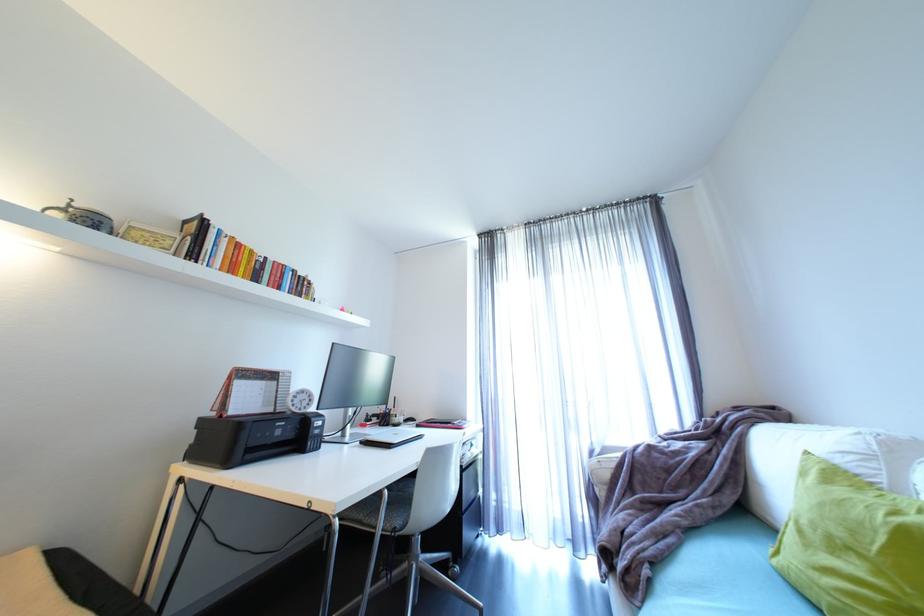
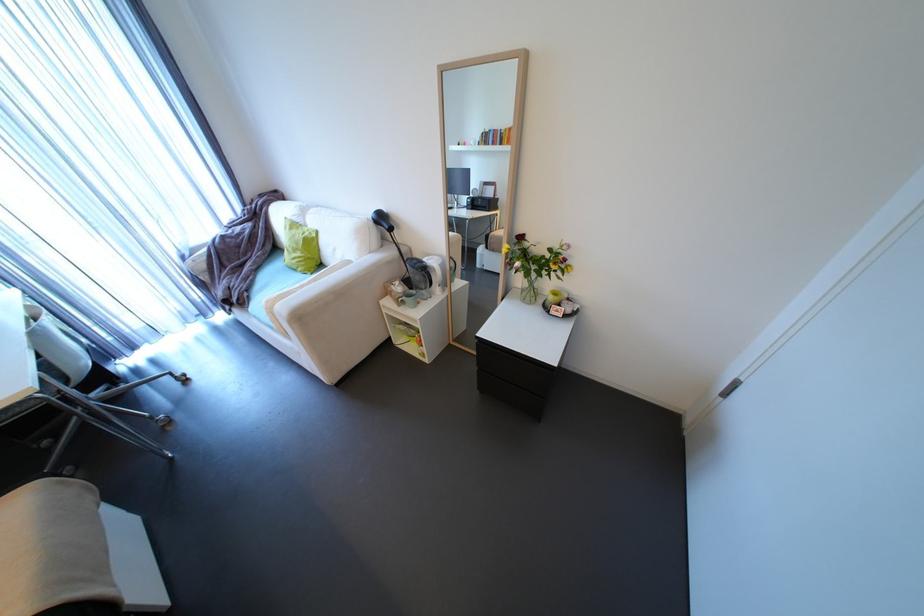
In the second image, find the point that corresponds to (320,508) in the first image.

(7, 408)